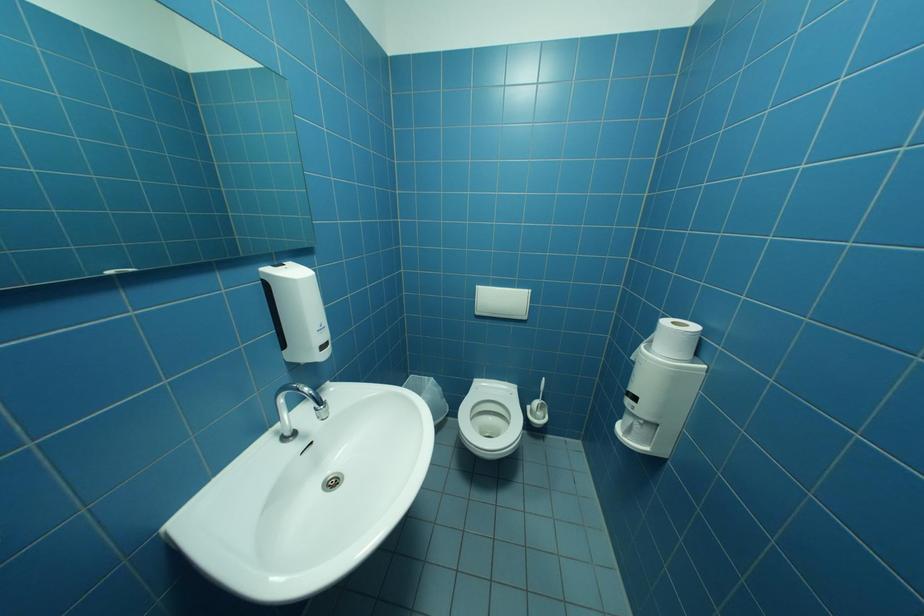
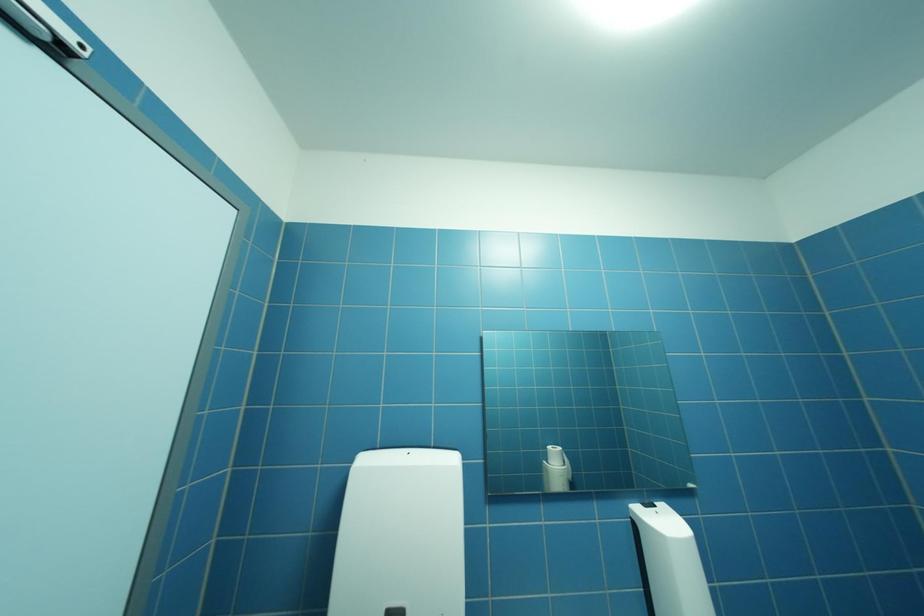
The first image is from the beginning of the video and the second image is from the end. How did the camera likely rotate when shooting the video?

The rotation direction of the camera is left-up.